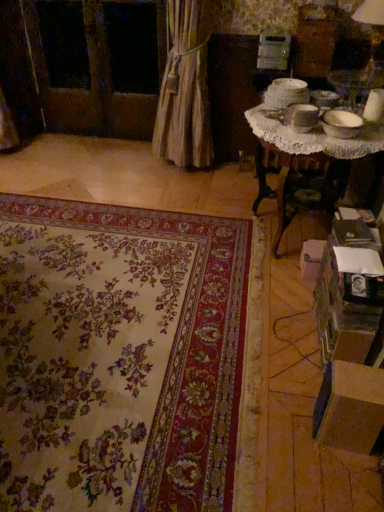
Where is `vacant position to the left of brown cardboard box at lower right, the 2th cardboard box viewed from the back`? vacant position to the left of brown cardboard box at lower right, the 2th cardboard box viewed from the back is located at coordinates (295, 426).